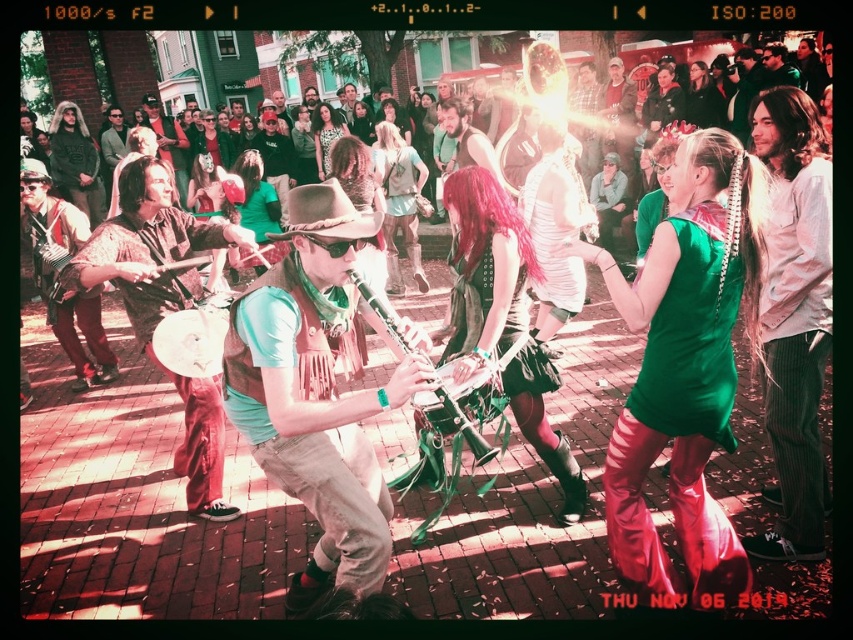
Can you confirm if matte green shirt at center is thinner than metallic green clarinet at center?

No, matte green shirt at center is not thinner than metallic green clarinet at center.

What do you see at coordinates (316, 392) in the screenshot?
I see `matte green shirt at center` at bounding box center [316, 392].

Which is behind, point (347, 262) or point (457, 426)?

Positioned behind is point (457, 426).

This screenshot has height=640, width=853. I want to click on matte green shirt at center, so click(316, 392).